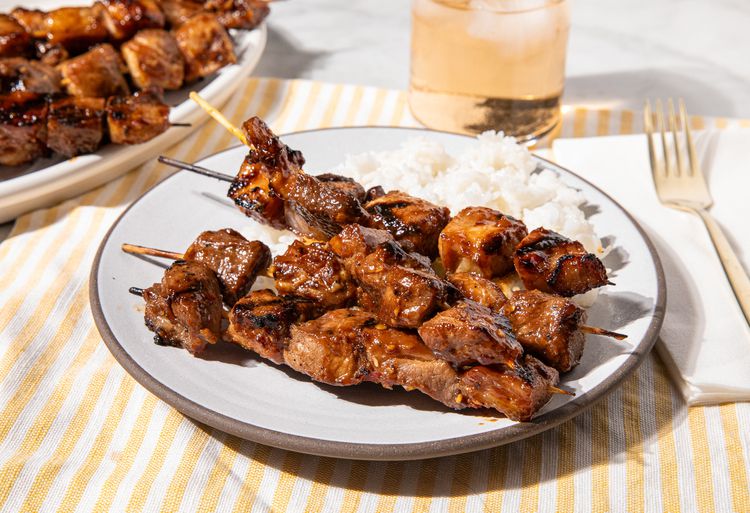
Where is `white plate`? white plate is located at coordinates (267, 400), (48, 177).